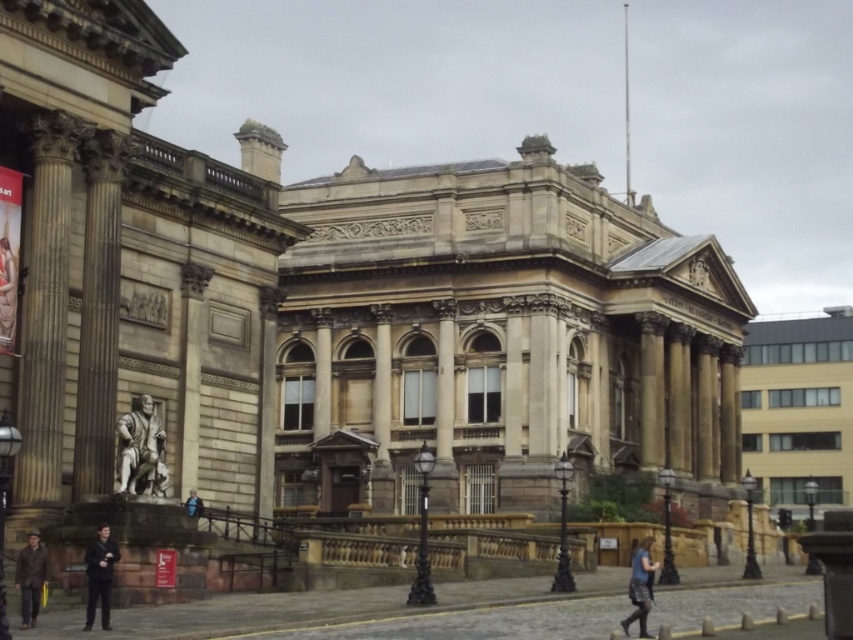
Question: Which of the following is the farthest from the observer?

Choices:
 (A) (192, 502)
 (B) (132, 451)
 (C) (86, 605)

Answer: (A)

Question: Which point is closer to the camera taking this photo?

Choices:
 (A) (9, 294)
 (B) (634, 573)

Answer: (B)

Question: Is leather jacket at lower left wider than blue fabric skirt at lower right?

Choices:
 (A) no
 (B) yes

Answer: (A)

Question: Which point is closer to the camera?

Choices:
 (A) [x=154, y=476]
 (B) [x=38, y=534]
 (C) [x=201, y=508]
 (D) [x=15, y=304]

Answer: (B)

Question: Observing the image, what is the correct spatial positioning of blue fabric skirt at lower right in reference to blue fabric jacket at lower center?

Choices:
 (A) right
 (B) left

Answer: (A)

Question: Is blue fabric skirt at lower right thinner than blue fabric jacket at lower center?

Choices:
 (A) yes
 (B) no

Answer: (B)